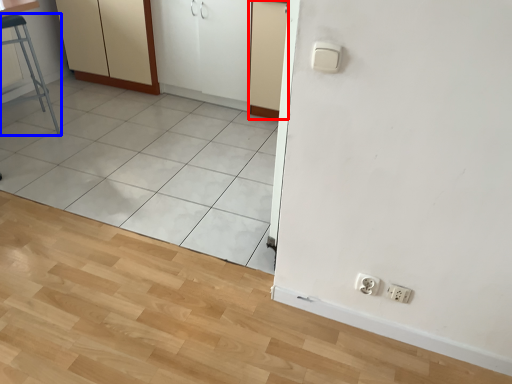
Question: Among these objects, which one is farthest to the camera, screen door (highlighted by a red box) or furniture (highlighted by a blue box)?

Choices:
 (A) screen door
 (B) furniture

Answer: (A)